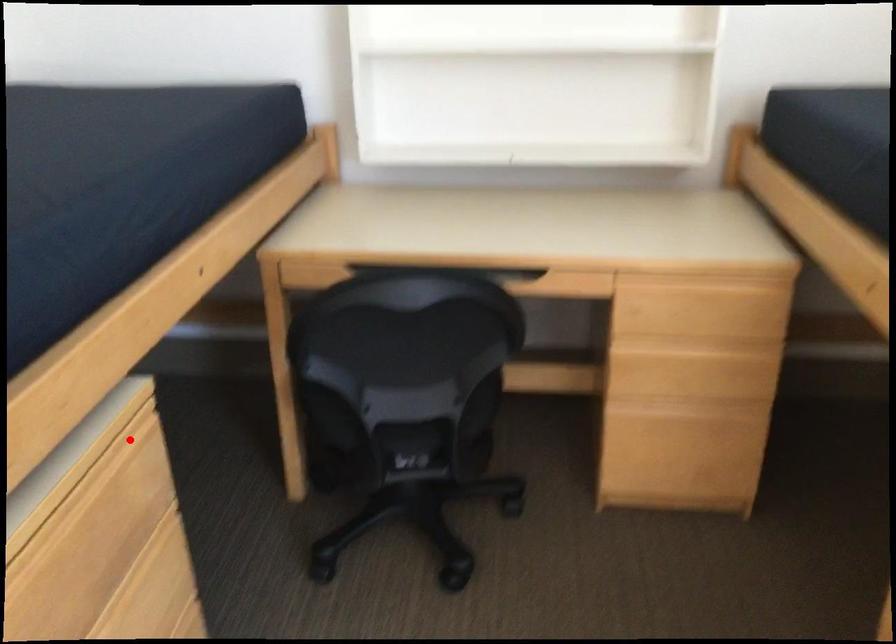
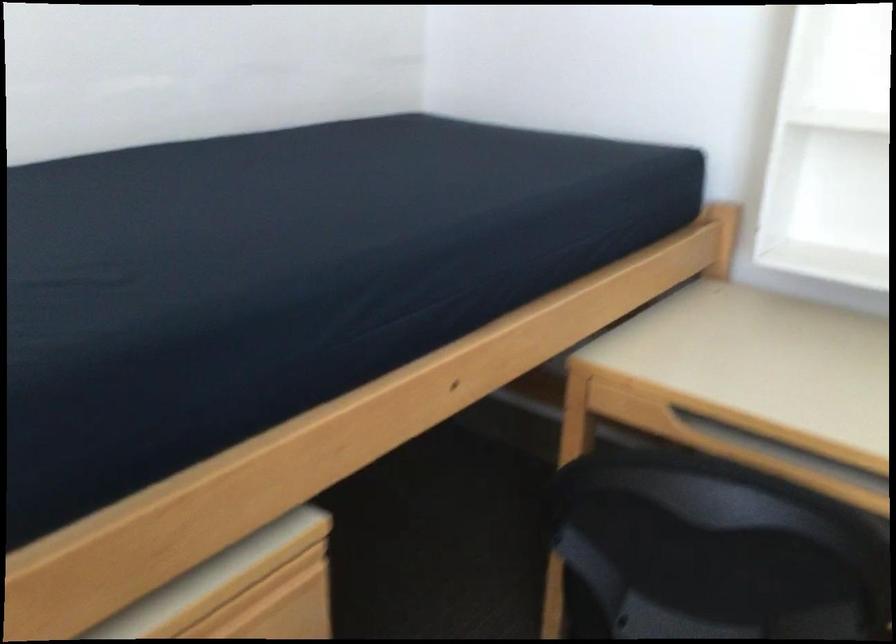
Question: I am providing you with two images of the same scene from different viewpoints. A red point is marked on the first image. Is the red point's position out of view in image 2?

Choices:
 (A) Yes
 (B) No

Answer: (B)